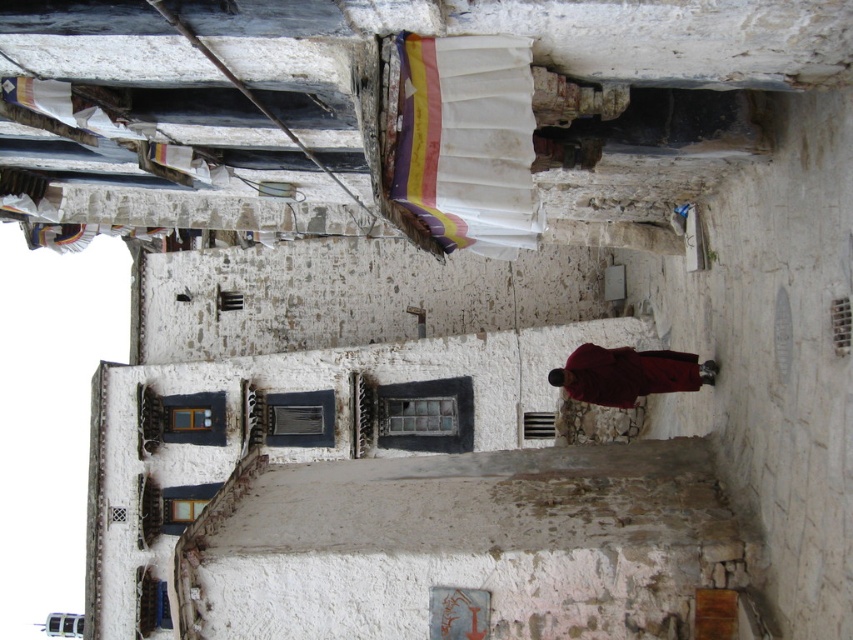
Question: Which point appears farthest from the camera in this image?

Choices:
 (A) (535, 220)
 (B) (598, 369)

Answer: (B)

Question: Can you confirm if white fabric at upper center is thinner than maroon woolen robe at center?

Choices:
 (A) no
 (B) yes

Answer: (B)

Question: Can you confirm if white fabric at upper center is positioned to the left of maroon woolen robe at center?

Choices:
 (A) yes
 (B) no

Answer: (A)

Question: Which point appears farthest from the camera in this image?

Choices:
 (A) (578, 376)
 (B) (448, 241)

Answer: (A)

Question: Does white fabric at upper center appear on the left side of maroon woolen robe at center?

Choices:
 (A) yes
 (B) no

Answer: (A)

Question: Which point is closer to the camera taking this photo?

Choices:
 (A) (398, 182)
 (B) (622, 371)

Answer: (A)